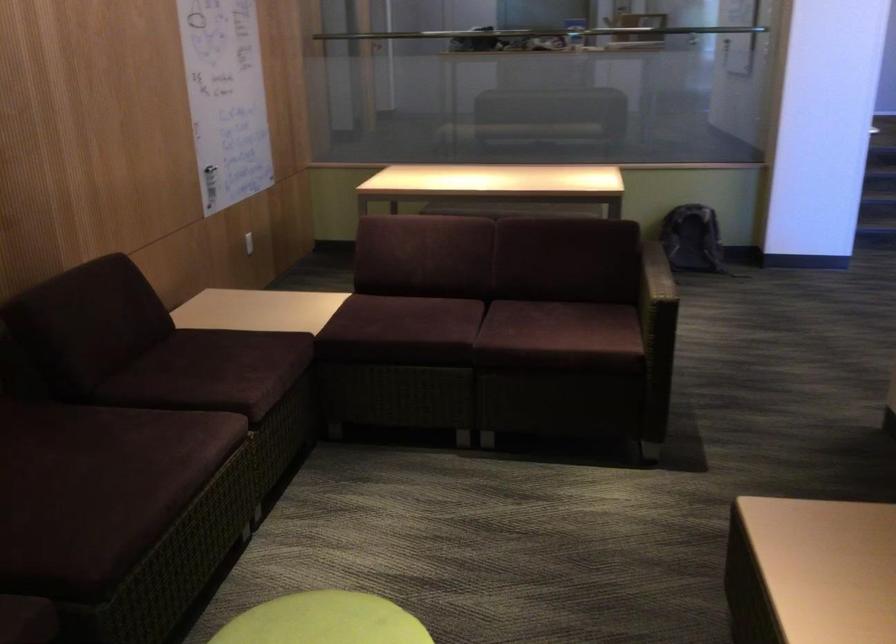
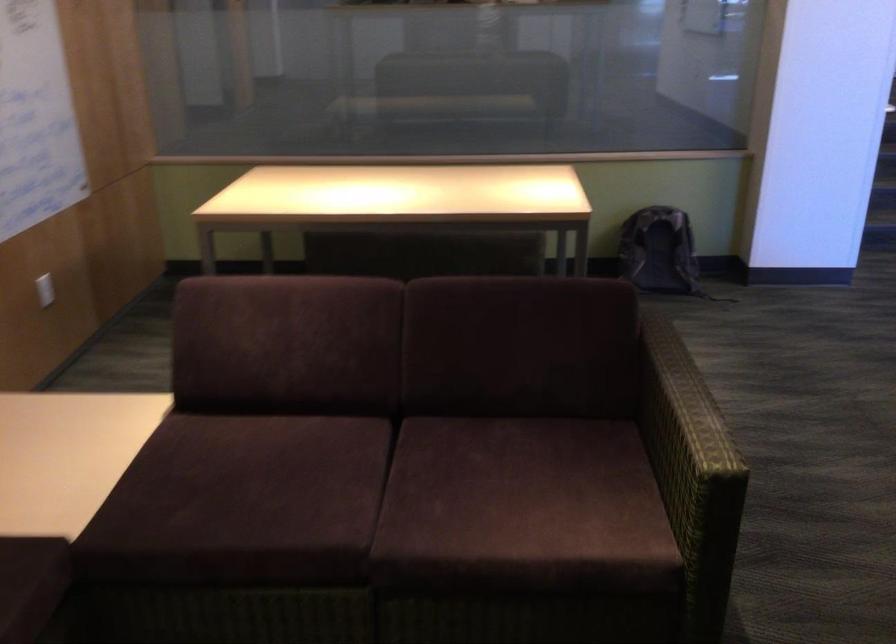
The point at (256,234) is marked in the first image. Where is the corresponding point in the second image?

(45, 289)